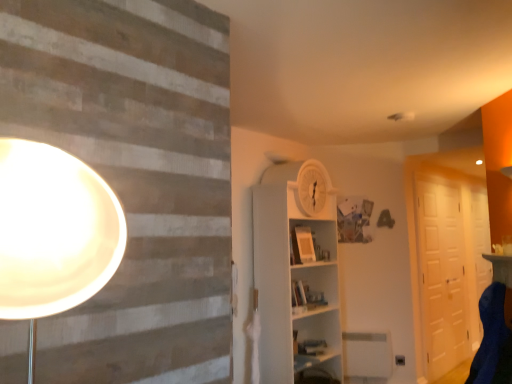
Question: From the image's perspective, is matte white table at right located above or below blue fabric swivel chair at lower right?

Choices:
 (A) above
 (B) below

Answer: (A)

Question: Is matte white table at right wider or thinner than blue fabric swivel chair at lower right?

Choices:
 (A) thin
 (B) wide

Answer: (A)

Question: Which object is the closest to the white glossy door at right?

Choices:
 (A) matte white table at right
 (B) blue fabric swivel chair at lower right
 (C) white matte barn door at right
 (D) white wooden shelf at center

Answer: (C)

Question: Which of these objects is positioned farthest from the white wooden shelf at center?

Choices:
 (A) blue fabric swivel chair at lower right
 (B) matte white table at right
 (C) white matte barn door at right
 (D) white glossy door at right

Answer: (D)